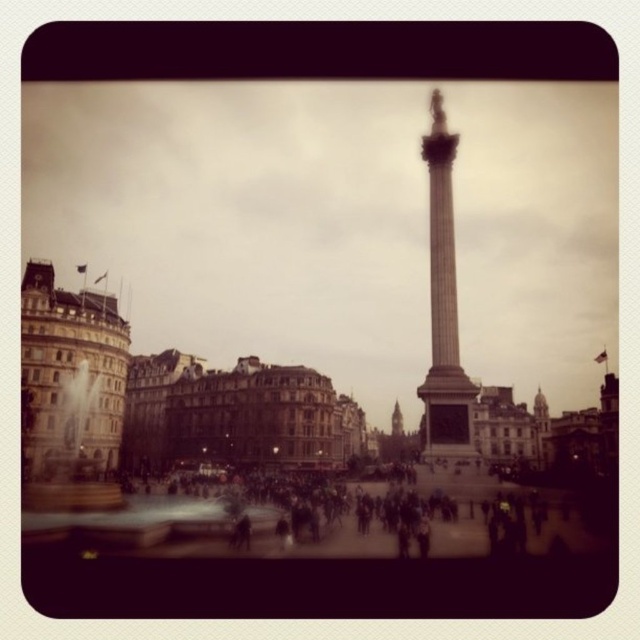
Question: Estimate the real-world distances between objects in this image. Which object is farther from the dark clothing crowd at center?

Choices:
 (A) smooth stone column at center
 (B) stone clock tower at center

Answer: (B)

Question: Which object is the farthest from the dark clothing crowd at center?

Choices:
 (A) smooth stone column at center
 (B) stone clock tower at center

Answer: (B)

Question: Is dark clothing crowd at center to the left of stone clock tower at center from the viewer's perspective?

Choices:
 (A) yes
 (B) no

Answer: (A)

Question: Is the position of dark clothing crowd at center less distant than that of smooth stone column at center?

Choices:
 (A) no
 (B) yes

Answer: (B)

Question: Which of the following is the farthest from the observer?

Choices:
 (A) (436, 435)
 (B) (492, 518)

Answer: (A)

Question: Is dark clothing crowd at center bigger than smooth stone column at center?

Choices:
 (A) yes
 (B) no

Answer: (B)